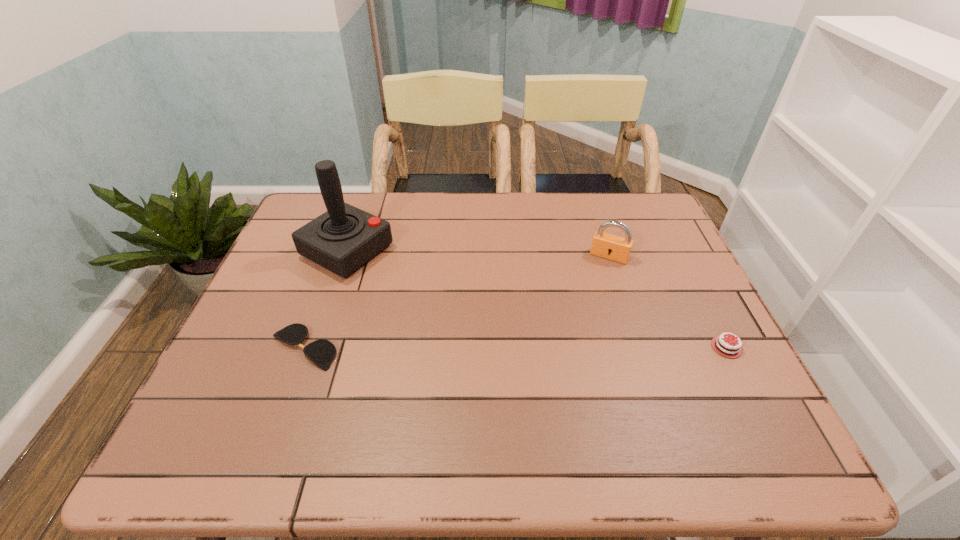
Where is `vacant spot on the desktop that is between the shortest object and the rightmost object and is positioned on the base of the joystick`? The width and height of the screenshot is (960, 540). vacant spot on the desktop that is between the shortest object and the rightmost object and is positioned on the base of the joystick is located at coordinates (539, 347).

The height and width of the screenshot is (540, 960). In order to click on vacant space on the desktop that is between the spectacles and the chocolate cake and is positioned to unlock the padlock from the front in this screenshot , I will do `click(570, 347)`.